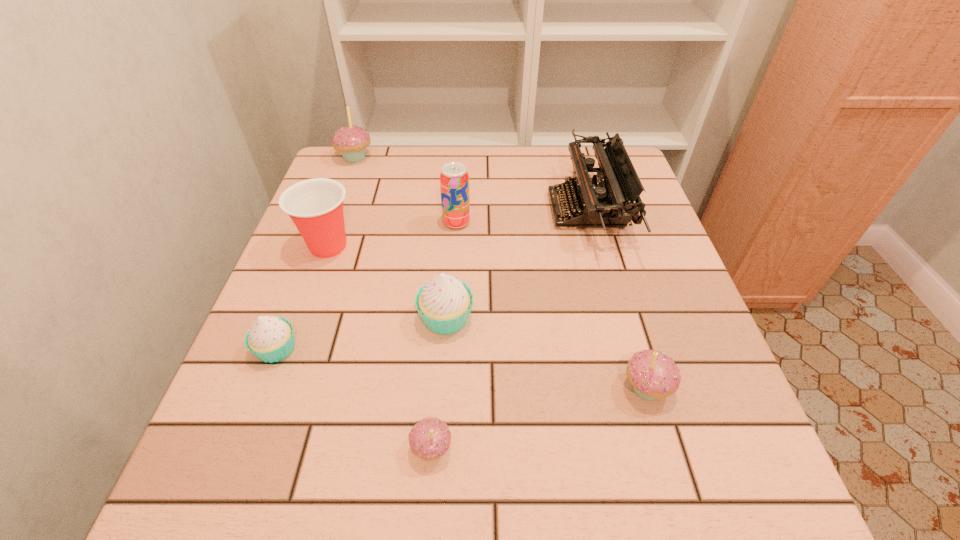
Find the location of a particular element. vacant area that satisfies the following two spatial constraints: 1. on the front side of the bigger white cupcake; 2. on the right side of the farthest cupcake is located at coordinates (296, 318).